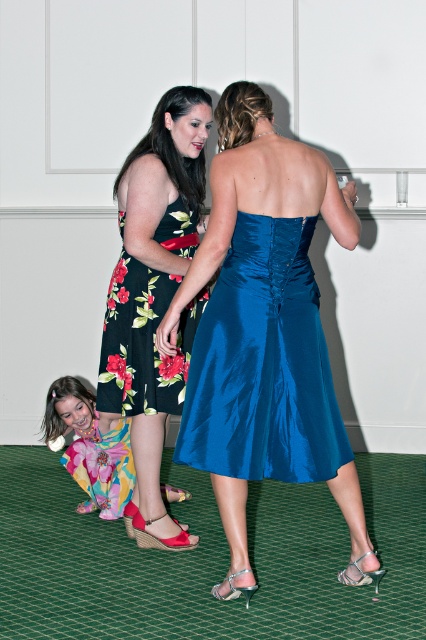
Question: Among these objects, which one is farthest from the camera?

Choices:
 (A) floral satin dress at center
 (B) clear plastic high-heeled sandal at lower center
 (C) floral print satin dress at center
 (D) red suede sandal at lower left

Answer: (D)

Question: Is floral print satin dress at center positioned before matte pink sandal at lower center?

Choices:
 (A) no
 (B) yes

Answer: (B)

Question: Which point is farther to the camera?

Choices:
 (A) (216, 592)
 (B) (77, 461)

Answer: (B)

Question: Which is farther from the shiny blue dress at center?

Choices:
 (A) floral print satin dress at center
 (B) floral satin dress at lower left
 (C) floral fabric dress at lower left

Answer: (C)

Question: Is blue satin dress at center to the left of matte pink sandal at lower center from the viewer's perspective?

Choices:
 (A) no
 (B) yes

Answer: (A)

Question: Is shiny pink sandal at lower left above matte pink sandal at lower center?

Choices:
 (A) no
 (B) yes

Answer: (A)